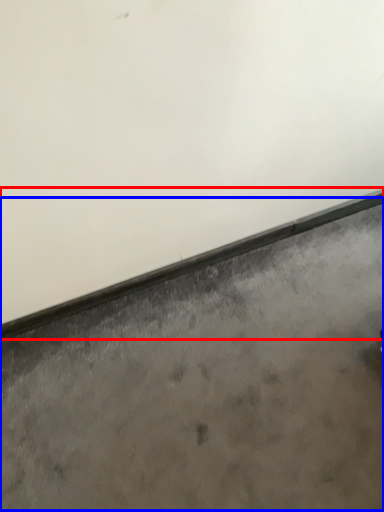
Question: Which object appears farthest to the camera in this image, window sill (highlighted by a red box) or concrete (highlighted by a blue box)?

Choices:
 (A) window sill
 (B) concrete

Answer: (A)